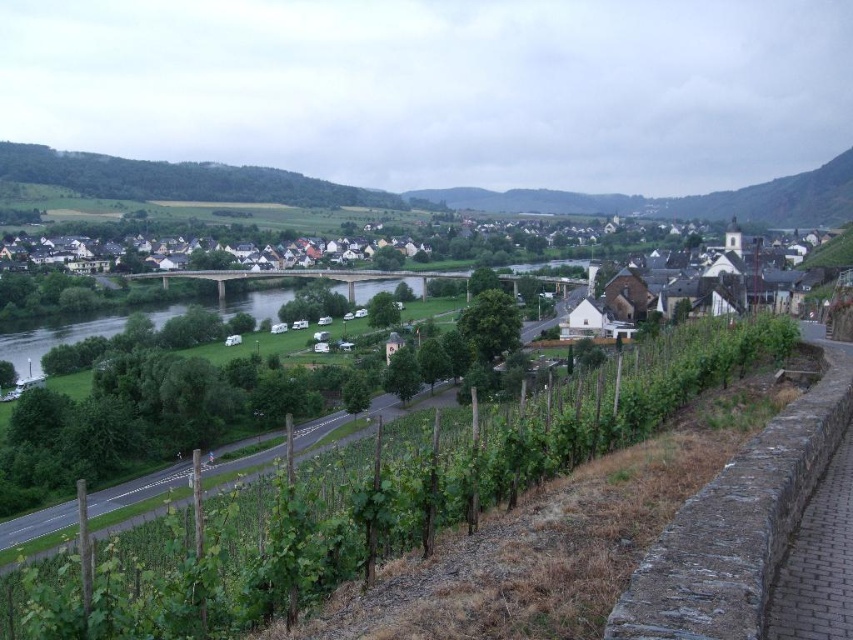
Is point (828, 595) positioned after point (412, 282)?

No, it is not.

Can you confirm if brick paved path at lower right is positioned to the right of green grassy river at center?

Correct, you'll find brick paved path at lower right to the right of green grassy river at center.

At what (x,y) coordinates should I click in order to perform the action: click on brick paved path at lower right. Please return your answer as a coordinate pair (x, y). Looking at the image, I should click on (817, 561).

I want to click on brick paved path at lower right, so click(817, 561).

How far apart are green leafy vineyard at lower left and white stone church at center-right?

68.23 meters

Based on the photo, can you confirm if green leafy vineyard at lower left is shorter than white stone church at center-right?

Indeed, green leafy vineyard at lower left has a lesser height compared to white stone church at center-right.

What do you see at coordinates (373, 499) in the screenshot? I see `green leafy vineyard at lower left` at bounding box center [373, 499].

The image size is (853, 640). I want to click on green leafy vineyard at lower left, so click(x=373, y=499).

Is white stone church at center-right smaller than brick paved path at lower right?

No, white stone church at center-right is not smaller than brick paved path at lower right.

Which is more to the left, white stone church at center-right or brick paved path at lower right?

brick paved path at lower right is more to the left.

Between point (656, 280) and point (834, 634), which one is positioned behind?

Point (656, 280)

Image resolution: width=853 pixels, height=640 pixels. Identify the location of white stone church at center-right. (700, 291).